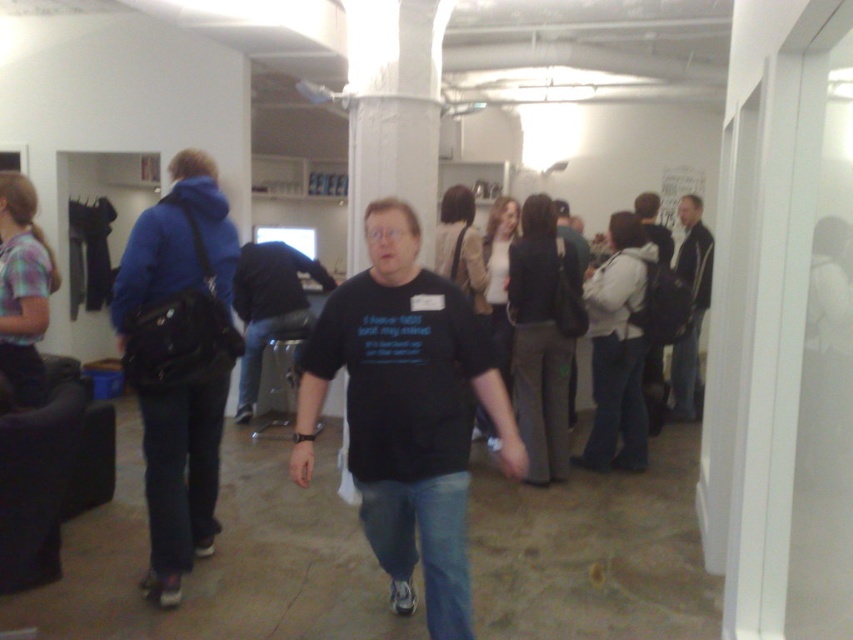
Question: Does black matte t-shirt at center lie in front of black leather jacket at right?

Choices:
 (A) yes
 (B) no

Answer: (A)

Question: Estimate the real-world distances between objects in this image. Which object is closer to the black leather jacket at right?

Choices:
 (A) black matte shirt at center
 (B) black matte t-shirt at center

Answer: (A)

Question: Based on their relative distances, which object is nearer to the black matte t-shirt at center?

Choices:
 (A) black leather jacket at right
 (B) black matte shirt at center

Answer: (B)

Question: Can you confirm if black matte shirt at center is thinner than black leather jacket at right?

Choices:
 (A) no
 (B) yes

Answer: (A)

Question: Considering the relative positions of black matte t-shirt at center and black leather jacket at right in the image provided, where is black matte t-shirt at center located with respect to black leather jacket at right?

Choices:
 (A) right
 (B) left

Answer: (B)

Question: Which object is the farthest from the black matte t-shirt at center?

Choices:
 (A) black matte shirt at center
 (B) black leather jacket at right

Answer: (B)